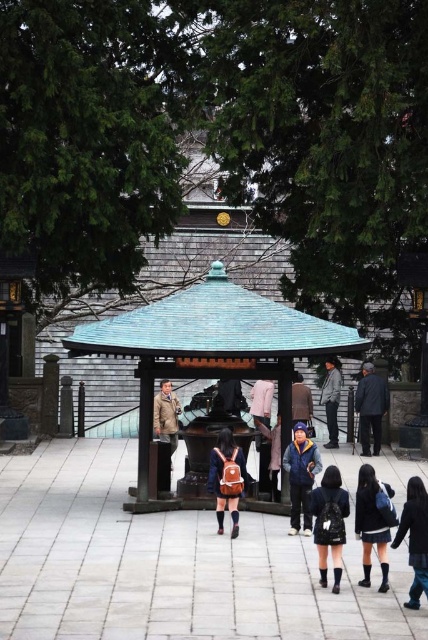
Between point (259, 337) and point (382, 538), which one is positioned in front?

Point (382, 538) is in front.

Does teal shingled gazebo at center have a greater width compared to black leather jacket at lower right?

Yes.

Is point (264, 314) farther from viewer compared to point (362, 504)?

Yes, point (264, 314) is behind point (362, 504).

The width and height of the screenshot is (428, 640). In order to click on teal shingled gazebo at center in this screenshot , I will do `click(210, 348)`.

Which of these two, dark blue denim skirt at center or denim jacket at center, stands taller?

With more height is dark blue denim skirt at center.

Which is below, dark blue denim skirt at center or denim jacket at center?

Positioned lower is dark blue denim skirt at center.

Is point (339, 545) behind point (279, 435)?

No, (339, 545) is in front of (279, 435).

The image size is (428, 640). Find the location of `dark blue denim skirt at center`. dark blue denim skirt at center is located at coordinates (329, 522).

Which of these two, dark gray fabric jacket at right or pink fabric pants at center, stands shorter?

pink fabric pants at center

Between dark gray fabric jacket at right and pink fabric pants at center, which one appears on the left side from the viewer's perspective?

pink fabric pants at center is more to the left.

Which is in front, point (374, 435) or point (258, 444)?

Point (258, 444) is more forward.

I want to click on dark gray fabric jacket at right, so click(x=371, y=406).